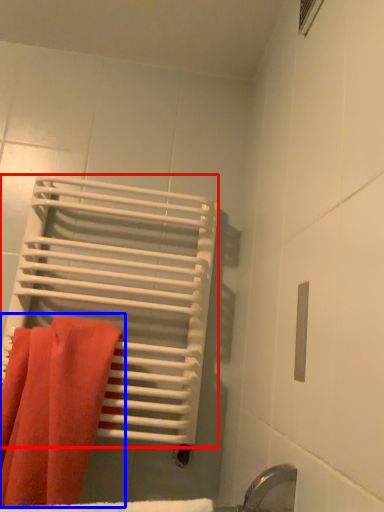
Question: Which of the following is the farthest to the observer, bath towel (highlighted by a red box) or towel (highlighted by a blue box)?

Choices:
 (A) bath towel
 (B) towel

Answer: (A)